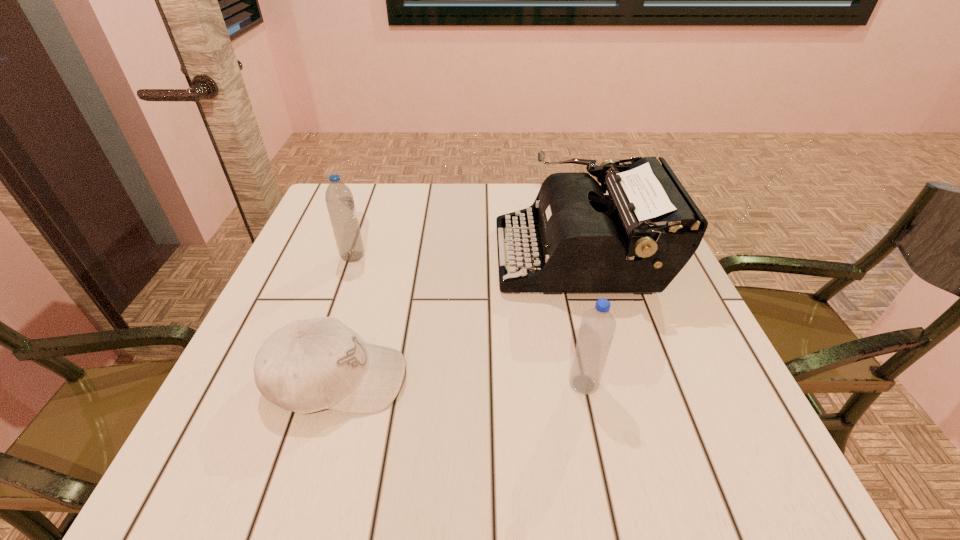
You are a GUI agent. You are given a task and a screenshot of the screen. Output one action in this format:
    pyautogui.click(x=<x>, y=<y>)
    Task: Click on the vacant space at the near right corner of the desktop
    
    Given the screenshot: What is the action you would take?
    pyautogui.click(x=687, y=491)

I want to click on vacant point located between the typewriter and the shortest object, so click(458, 318).

I want to click on vacant space in between the typewriter and the left water bottle, so click(467, 256).

You are a GUI agent. You are given a task and a screenshot of the screen. Output one action in this format:
    pyautogui.click(x=<x>, y=<y>)
    Task: Click on the free area in between the left water bottle and the nearer water bottle
    
    Given the screenshot: What is the action you would take?
    468,320

Where is `unoccupied area between the typewriter and the left water bottle`? This screenshot has width=960, height=540. unoccupied area between the typewriter and the left water bottle is located at coordinates (467, 256).

Where is `free spot between the left water bottle and the typewriter`? The width and height of the screenshot is (960, 540). free spot between the left water bottle and the typewriter is located at coordinates (467, 256).

At what (x,y) coordinates should I click in order to perform the action: click on vacant space that's between the left water bottle and the right water bottle. Please return your answer as a coordinate pair (x, y). This screenshot has height=540, width=960. Looking at the image, I should click on (468, 320).

Identify which object is located as the third nearest to the baseball cap. Please provide its 2D coordinates. Your answer should be formatted as a tuple, i.e. [(x, y)], where the tuple contains the x and y coordinates of a point satisfying the conditions above.

[(598, 325)]

Where is `the third closest object to the left water bottle`? Image resolution: width=960 pixels, height=540 pixels. the third closest object to the left water bottle is located at coordinates (598, 325).

At what (x,y) coordinates should I click in order to perform the action: click on vacant space that satisfies the following two spatial constraints: 1. on the typing side of the typewriter; 2. on the front side of the nearer water bottle. Please return your answer as a coordinate pair (x, y). Looking at the image, I should click on (615, 384).